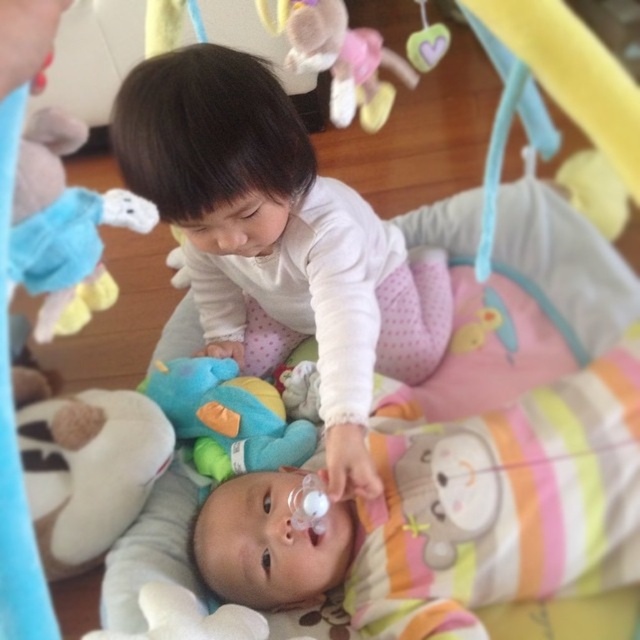
You are a parent trying to place a small toy on the play mat. You have the white plush toy at lower left and the soft plush elephant at upper left. Which toy should you choose if you want to place it where it won

The white plush toy at lower left is much taller than the soft plush elephant at upper left, so you should choose the soft plush elephant at upper left if you want to place it where it won

You are a parent holding a 12 inch long toy. You want to place it between the soft plush elephant at upper left and yourself. Is there enough space?

The distance between the soft plush elephant at upper left and the viewer is 22.14 inches, so yes, the parent can place the 12 inch long toy between the soft plush elephant at upper left and themselves since the space is larger than the toy.

In the scene shown: You are a parent trying to locate the pacifier that belongs to the baby on the play mat. The pacifier is marked by the point at coordinates point (280, 241). Based on the scene description, where would you find the pacifier?

The pacifier marked by point (280, 241) is located on the smooth white toddler at center.